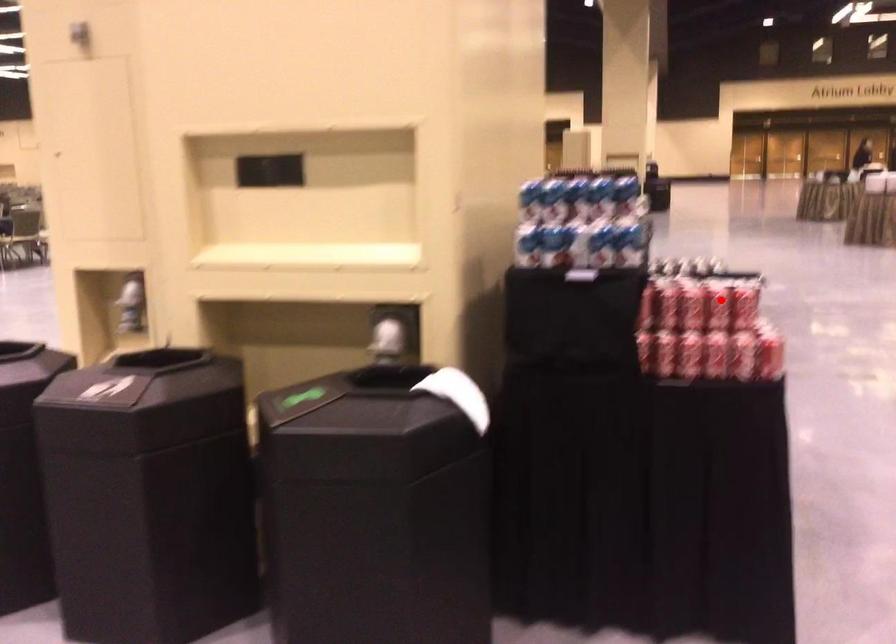
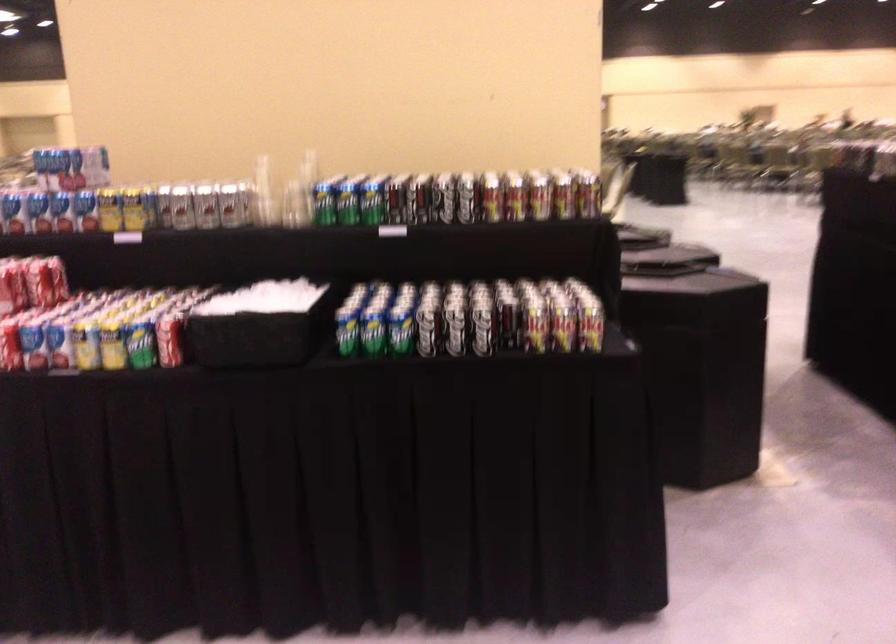
Where in the second image is the point corresponding to the highlighted location from the first image?

(12, 287)